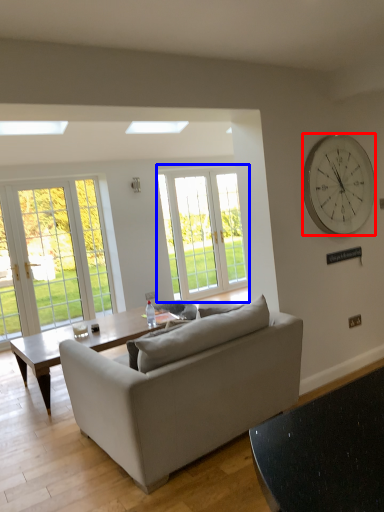
Question: Which point is closer to the camera, wall clock (highlighted by a red box) or window (highlighted by a blue box)?

Choices:
 (A) wall clock
 (B) window

Answer: (A)